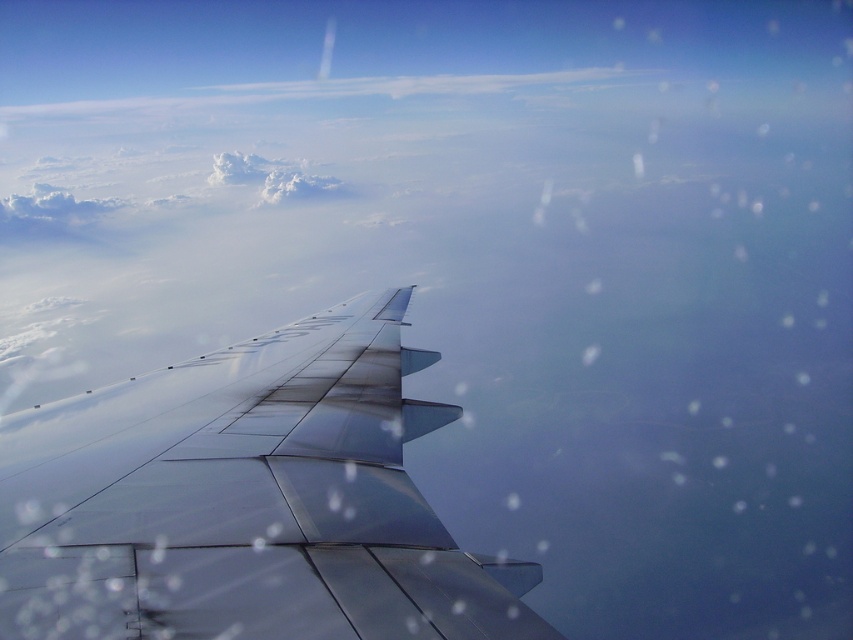
You are a pilot flying at an altitude of 10,000 meters. You notice the metallic silver wing at lower left and the white fluffy cloud at upper center. How far apart are these two objects in meters?

The metallic silver wing at lower left and the white fluffy cloud at upper center are 673.98 meters apart from each other.

You are seated in an airplane and looking out the window. You notice a point at coordinates (247, 500). What object is located at this point?

The point at coordinates (247, 500) indicates the metallic silver wing at lower left.

You are seated in an airplane and looking out the window. You notice the metallic silver wing at lower left. Based on its position, can you determine if it is closer to the window or further away compared to the clouds in the sky?

The metallic silver wing at lower left is located at point (x=247, y=500), which is closer to the window than the clouds in the sky. Therefore, the metallic silver wing at lower left is closer to you.